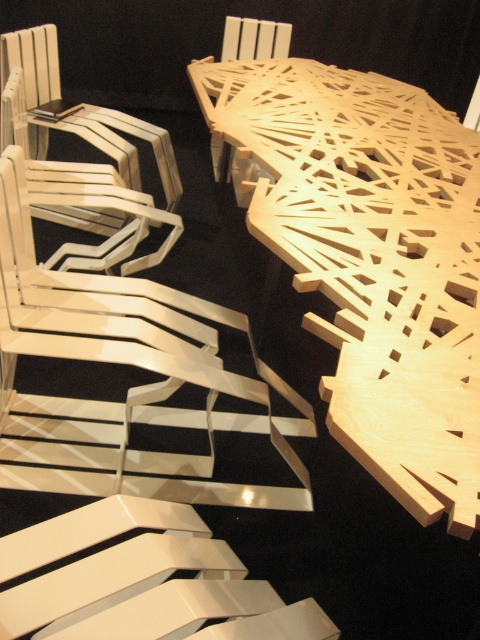
You are arranging a dinner party and need to seat guests. You have a matte white chair at upper left and a wooden chair at upper center. Which chair is positioned lower in the seating arrangement?

The matte white chair at upper left is located below the wooden chair at upper center, so it is positioned lower in the seating arrangement.

You are sitting in the white wood chair at left and want to reach the natural wood table at center to grab a pen. In which direction should you move to get to the table?

The natural wood table at center is to the right of the white wood chair at left, so you should move to your right to reach the table.

You are standing in front of the table and chairs. You notice two points marked on the table surface. The first point is located at coordinates point (444,323) and the second at point (302,404). Which point is closer to you?

Point (444,323) is closer to the camera than point (302,404).